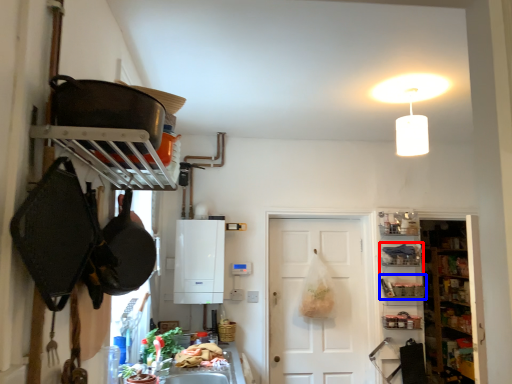
Question: Which of the following is the closest to the observer, shelf (highlighted by a red box) or shelf (highlighted by a blue box)?

Choices:
 (A) shelf
 (B) shelf

Answer: (B)